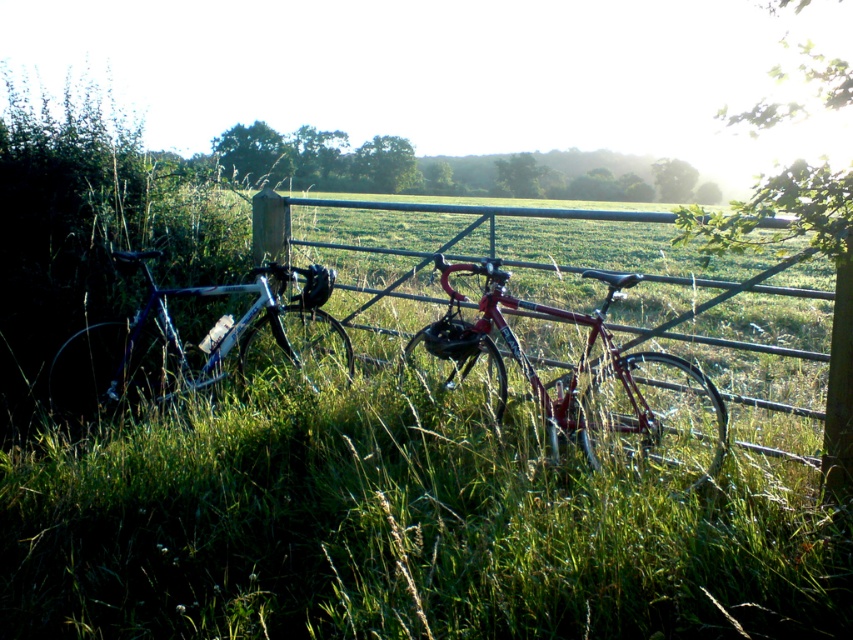
Question: Does shiny metallic bicycle at center come behind shiny silver bicycle at left?

Choices:
 (A) no
 (B) yes

Answer: (A)

Question: Which of these objects is positioned closest to the metallic gate at center?

Choices:
 (A) shiny silver bicycle at left
 (B) shiny metallic bicycle at center

Answer: (B)

Question: Which of the following is the farthest from the observer?

Choices:
 (A) (653, 376)
 (B) (117, 323)
 (C) (840, 432)

Answer: (A)

Question: Is shiny silver bicycle at left smaller than metallic gate at center?

Choices:
 (A) no
 (B) yes

Answer: (B)

Question: Observing the image, what is the correct spatial positioning of shiny metallic bicycle at center in reference to metallic gate at center?

Choices:
 (A) below
 (B) above

Answer: (A)

Question: Estimate the real-world distances between objects in this image. Which object is farther from the metallic gate at center?

Choices:
 (A) shiny silver bicycle at left
 (B) shiny metallic bicycle at center

Answer: (A)